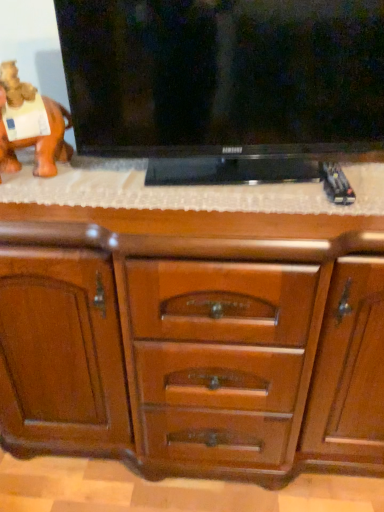
Identify the location of empty space that is to the right of orange matte elephant at left. Image resolution: width=384 pixels, height=512 pixels. (99, 177).